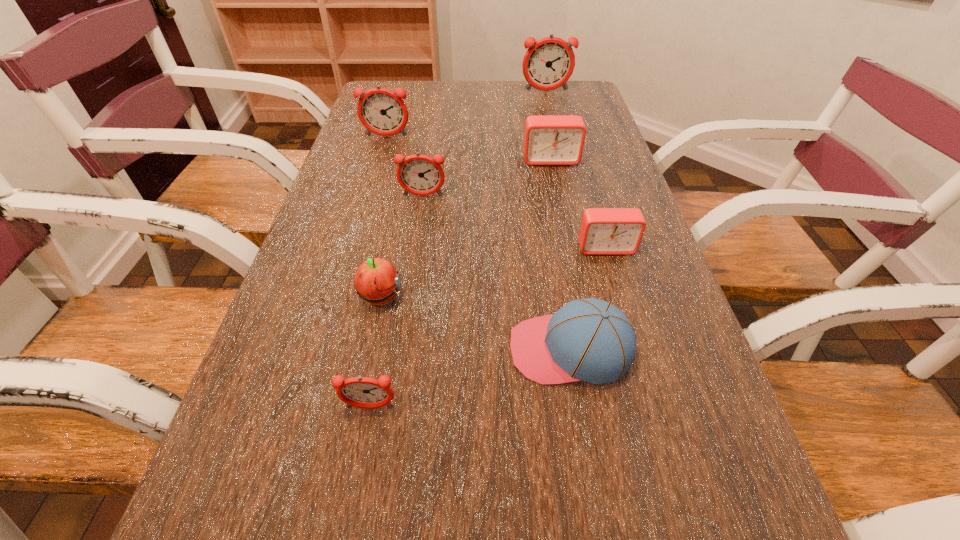
You are a GUI agent. You are given a task and a screenshot of the screen. Output one action in this format:
    pyautogui.click(x=<x>, y=<y>)
    Task: Click on the smaller red alarm clock
    The width and height of the screenshot is (960, 540).
    Given the screenshot: What is the action you would take?
    pyautogui.click(x=603, y=231)

The image size is (960, 540). In order to click on the fifth farthest alarm clock in this screenshot , I will do `click(603, 231)`.

Locate an element on the screen. The height and width of the screenshot is (540, 960). the nearest alarm clock is located at coordinates (362, 392).

At what (x,y) coordinates should I click in order to perform the action: click on the nearest object. Please return your answer as a coordinate pair (x, y). The image size is (960, 540). Looking at the image, I should click on (362, 392).

Image resolution: width=960 pixels, height=540 pixels. I want to click on vacant space located on the front-facing side of the biggest reddish-pink alarm clock, so click(555, 128).

This screenshot has height=540, width=960. Identify the location of vacant space positioned 0.400m on the front-facing side of the seventh shortest object. (360, 228).

Locate an element on the screen. vacant space located on the front-facing side of the third farthest reddish-pink alarm clock is located at coordinates (415, 249).

Image resolution: width=960 pixels, height=540 pixels. Identify the location of vacant space located 0.230m on the front-facing side of the farther red alarm clock. (564, 221).

Where is `free region located 0.380m on the front-facing side of the baseball cap`? Image resolution: width=960 pixels, height=540 pixels. free region located 0.380m on the front-facing side of the baseball cap is located at coordinates (293, 349).

The width and height of the screenshot is (960, 540). What are the coordinates of `vacant space located on the front-facing side of the baseball cap` in the screenshot? It's located at (465, 349).